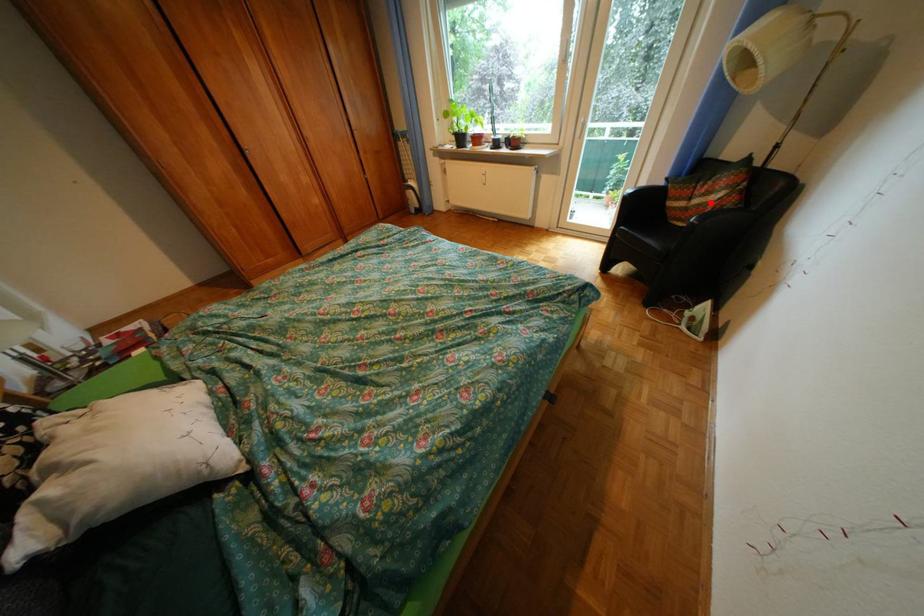
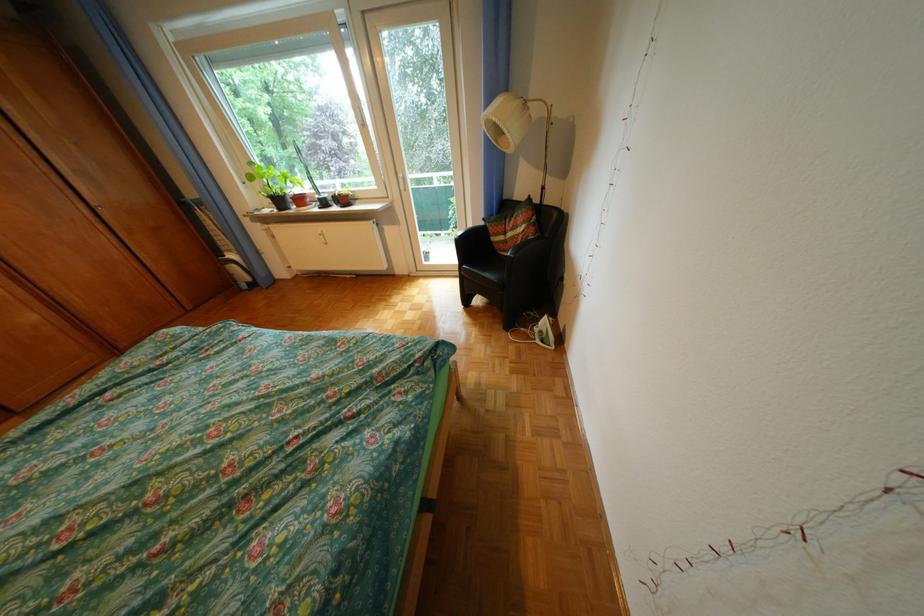
Question: A red point is marked in image1. In image2, is the corresponding 3D point closer to the camera or farther? Reply with the corresponding letter.

Choices:
 (A) The corresponding 3D point is closer.
 (B) The corresponding 3D point is farther.

Answer: (A)